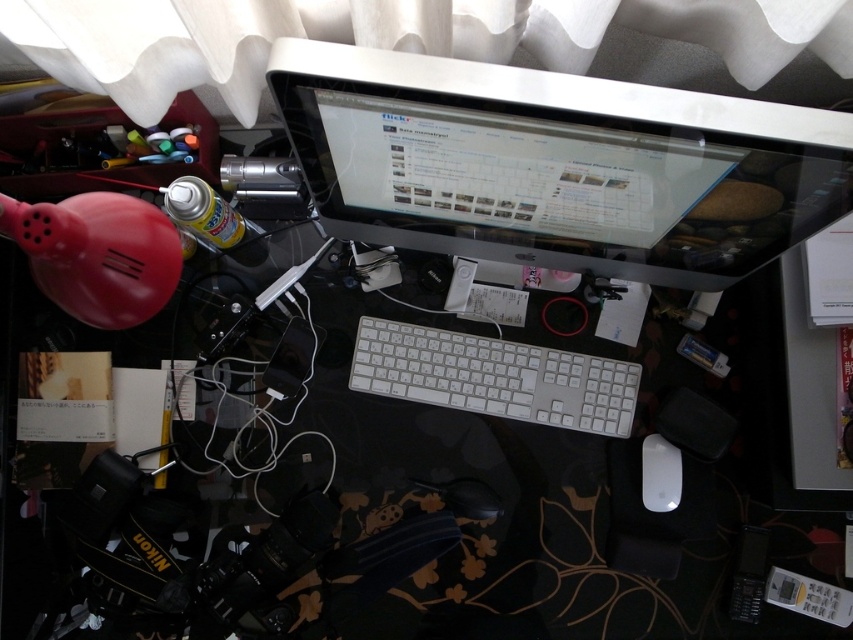
Question: Which point is farther from the camera taking this photo?

Choices:
 (A) (601, 413)
 (B) (666, 488)

Answer: (A)

Question: Does white plastic keyboard at center have a lesser width compared to white matte mouse at lower right?

Choices:
 (A) yes
 (B) no

Answer: (B)

Question: Estimate the real-world distances between objects in this image. Which object is farther from the white matte mouse at lower right?

Choices:
 (A) white plastic keyboard at center
 (B) sleek silver monitor at upper center

Answer: (B)

Question: Does sleek silver monitor at upper center have a smaller size compared to white plastic keyboard at center?

Choices:
 (A) no
 (B) yes

Answer: (A)

Question: Which point is closer to the camera?

Choices:
 (A) white plastic keyboard at center
 (B) white matte mouse at lower right

Answer: (B)

Question: Can you confirm if sleek silver monitor at upper center is bigger than white matte mouse at lower right?

Choices:
 (A) yes
 (B) no

Answer: (A)